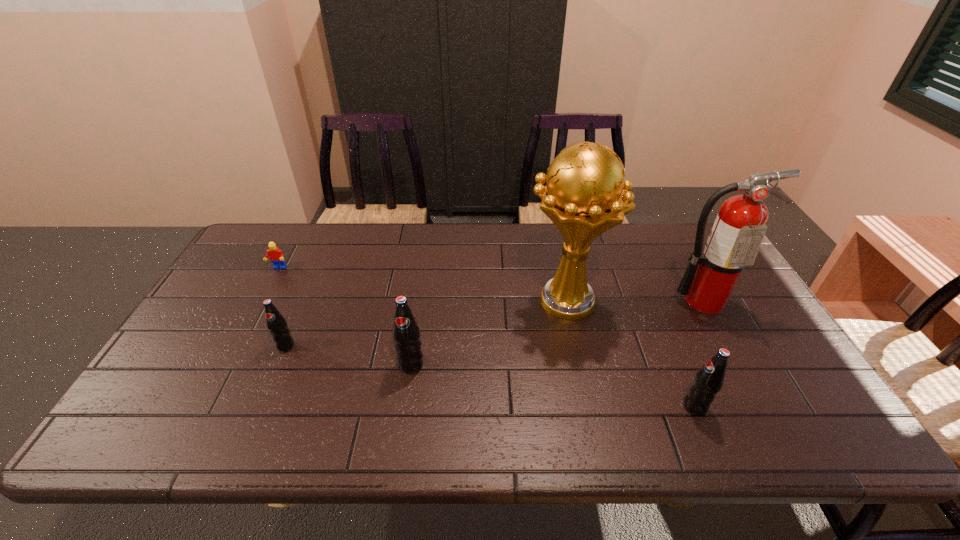
The width and height of the screenshot is (960, 540). I want to click on the shortest pop, so click(x=276, y=324).

Where is `the second shortest object`? the second shortest object is located at coordinates (276, 324).

You are a GUI agent. You are given a task and a screenshot of the screen. Output one action in this format:
    pyautogui.click(x=<x>, y=<y>)
    Task: Click on the fourth object from right to left
    
    Given the screenshot: What is the action you would take?
    pyautogui.click(x=406, y=334)

Find the location of a particular element. Image resolution: width=960 pixels, height=540 pixels. the second pop from right to left is located at coordinates (406, 334).

Locate an element on the screen. This screenshot has height=540, width=960. the fourth tallest object is located at coordinates (709, 380).

Where is `the second tallest pop`? the second tallest pop is located at coordinates (709, 380).

Identify the location of Lego. Image resolution: width=960 pixels, height=540 pixels. (276, 256).

Where is `the shortest object`? the shortest object is located at coordinates (276, 256).

Find the location of `fire extinguisher`. fire extinguisher is located at coordinates (739, 228).

Identify the location of trophy_cup. The image size is (960, 540). (585, 195).